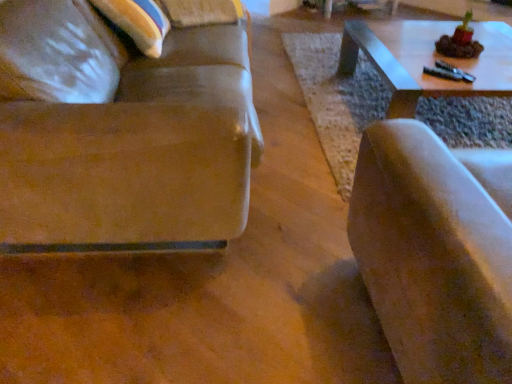
Identify the location of suede-like brown couch at left. The height and width of the screenshot is (384, 512). (124, 130).

This screenshot has width=512, height=384. What do you see at coordinates (124, 130) in the screenshot?
I see `suede-like brown couch at left` at bounding box center [124, 130].

What is the approximate height of suede-like beige chair at right?

28.48 inches.

The height and width of the screenshot is (384, 512). What do you see at coordinates (436, 252) in the screenshot?
I see `suede-like beige chair at right` at bounding box center [436, 252].

Identify the location of suede-like beige chair at right. (436, 252).

What are the coordinates of `suede-like brown couch at left` in the screenshot? It's located at (124, 130).

Between suede-like brown couch at left and suede-like beige chair at right, which one appears on the left side from the viewer's perspective?

Positioned to the left is suede-like brown couch at left.

Does suede-like brown couch at left lie in front of suede-like beige chair at right?

No, suede-like brown couch at left is further to the viewer.

Is point (227, 91) less distant than point (444, 173)?

No.

From the picture: From the image's perspective, which one is positioned lower, suede-like brown couch at left or suede-like beige chair at right?

suede-like beige chair at right.

From a real-world perspective, between suede-like brown couch at left and suede-like beige chair at right, who is vertically lower?

suede-like brown couch at left, from a real-world perspective.

Is suede-like brown couch at left thinner than suede-like beige chair at right?

In fact, suede-like brown couch at left might be wider than suede-like beige chair at right.

Does suede-like brown couch at left have a lesser height compared to suede-like beige chair at right?

In fact, suede-like brown couch at left may be taller than suede-like beige chair at right.

Is suede-like brown couch at left bigger than suede-like beige chair at right?

Yes, suede-like brown couch at left is bigger than suede-like beige chair at right.

Can we say suede-like brown couch at left lies outside suede-like beige chair at right?

Absolutely, suede-like brown couch at left is external to suede-like beige chair at right.

Is suede-like brown couch at left positioned far away from suede-like beige chair at right?

suede-like brown couch at left is actually quite close to suede-like beige chair at right.

Is suede-like beige chair at right at the back of suede-like brown couch at left?

No, suede-like brown couch at left is not facing away from suede-like beige chair at right.

At what (x,y) coordinates should I click in order to perform the action: click on chair that appears below the suede-like brown couch at left (from the image's perspective). Please return your answer as a coordinate pair (x, y). The width and height of the screenshot is (512, 384). Looking at the image, I should click on (436, 252).

Which object is positioned more to the right, suede-like beige chair at right or suede-like brown couch at left?

Positioned to the right is suede-like beige chair at right.

Which object is closer to the camera taking this photo, suede-like beige chair at right or suede-like brown couch at left?

suede-like beige chair at right is closer to the camera.

Does point (431, 330) lie in front of point (149, 231)?

Yes.

From the image's perspective, is suede-like beige chair at right over suede-like brown couch at left?

No, from the image's perspective, suede-like beige chair at right is not on top of suede-like brown couch at left.

From a real-world perspective, which is physically below, suede-like beige chair at right or suede-like brown couch at left?

suede-like brown couch at left, from a real-world perspective.

Considering the sizes of objects suede-like beige chair at right and suede-like brown couch at left in the image provided, who is wider, suede-like beige chair at right or suede-like brown couch at left?

Wider between the two is suede-like brown couch at left.

In the scene shown: Can you confirm if suede-like beige chair at right is taller than suede-like brown couch at left?

No.

Considering the sizes of objects suede-like beige chair at right and suede-like brown couch at left in the image provided, who is smaller, suede-like beige chair at right or suede-like brown couch at left?

suede-like beige chair at right is smaller.

Consider the image. Do you think suede-like beige chair at right is within suede-like brown couch at left, or outside of it?

suede-like beige chair at right exists outside the volume of suede-like brown couch at left.

Is suede-like beige chair at right placed right next to suede-like brown couch at left?

They are not placed beside each other.

Looking at this image, is suede-like beige chair at right positioned with its back to suede-like brown couch at left?

No, suede-like beige chair at right's orientation is not away from suede-like brown couch at left.

How different are the orientations of suede-like beige chair at right and suede-like brown couch at left in degrees?

The facing directions of suede-like beige chair at right and suede-like brown couch at left are 92.4 degrees apart.

Find the location of `studio couch on the left side of suede-like beige chair at right`. studio couch on the left side of suede-like beige chair at right is located at coordinates (124, 130).

Locate an element on the screen. The height and width of the screenshot is (384, 512). studio couch behind the suede-like beige chair at right is located at coordinates (124, 130).

At what (x,y) coordinates should I click in order to perform the action: click on studio couch on the left of the suede-like beige chair at right. Please return your answer as a coordinate pair (x, y). Looking at the image, I should click on (124, 130).